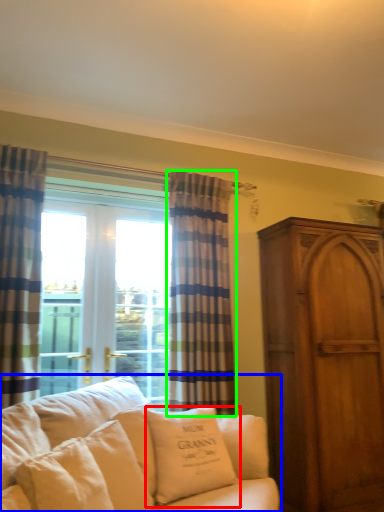
Question: Considering the real-world distances, which object is closest to pillow (highlighted by a red box)? studio couch (highlighted by a blue box) or curtain (highlighted by a green box).

Choices:
 (A) studio couch
 (B) curtain

Answer: (A)